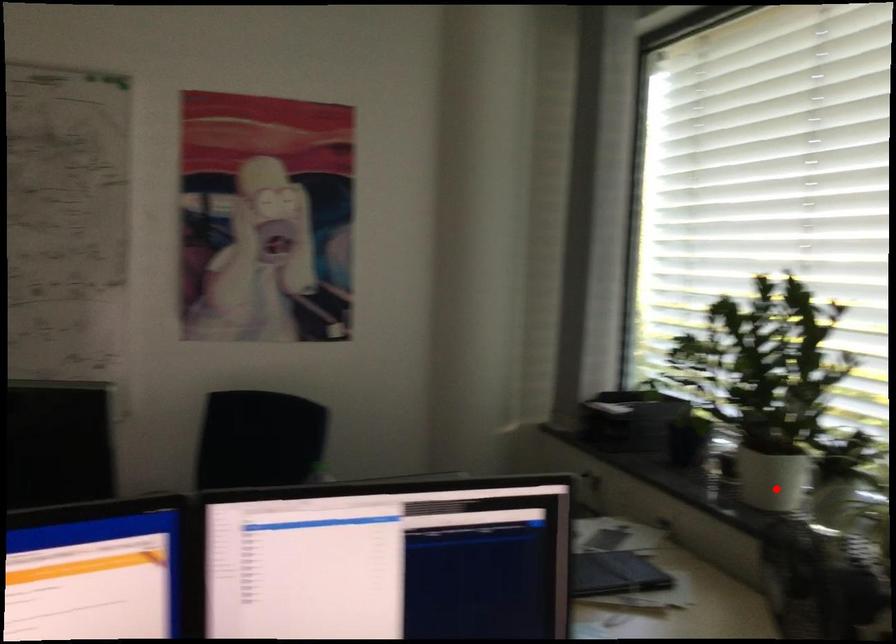
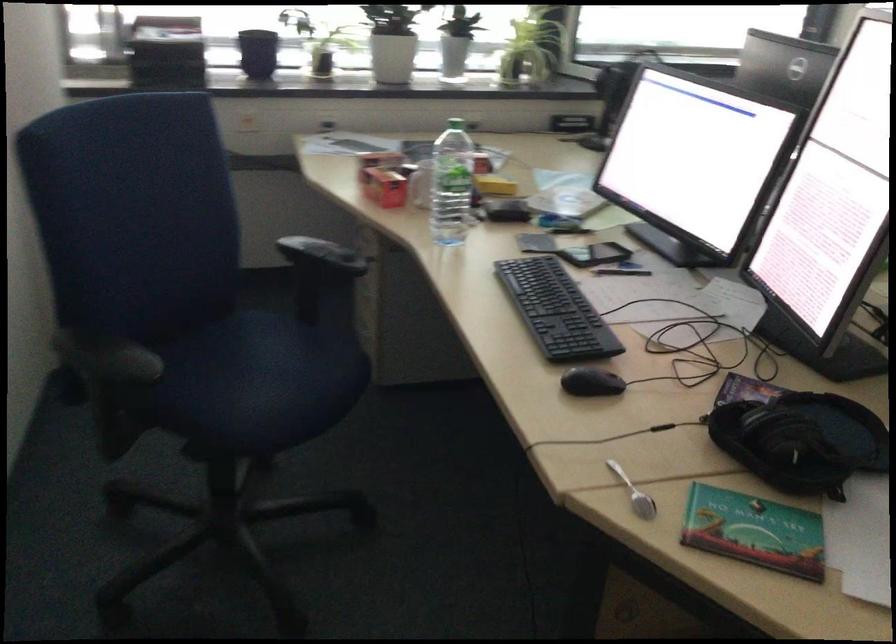
In the second image, find the point that corresponds to the highlighted location in the first image.

(392, 58)